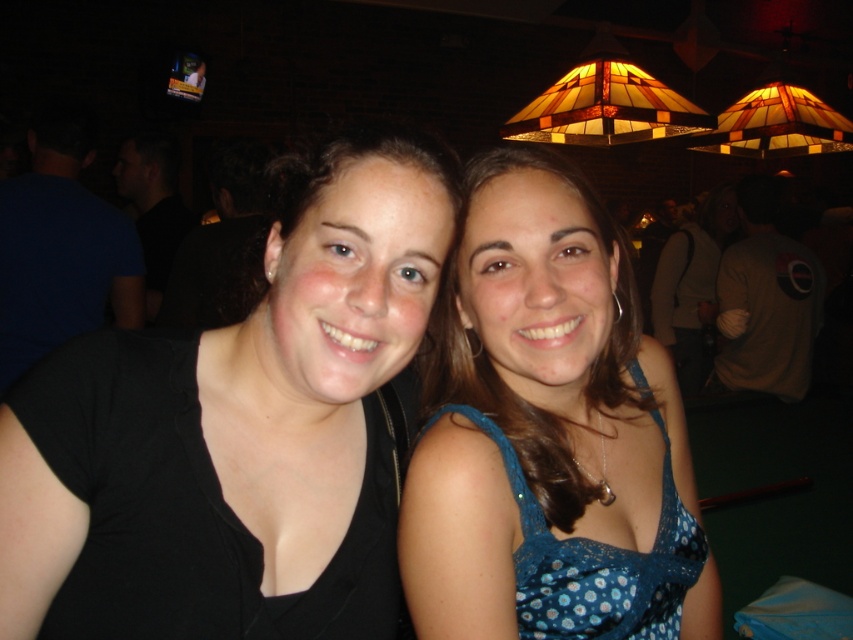
Question: Which point is closer to the camera taking this photo?

Choices:
 (A) (537, 172)
 (B) (33, 384)

Answer: (B)

Question: Does black matte shirt at left lie behind blue dotted dress at center?

Choices:
 (A) no
 (B) yes

Answer: (A)

Question: Is black matte shirt at left closer to camera compared to blue dotted dress at center?

Choices:
 (A) yes
 (B) no

Answer: (A)

Question: Is black matte shirt at left wider than blue dotted dress at center?

Choices:
 (A) yes
 (B) no

Answer: (B)

Question: Which object appears closest to the camera in this image?

Choices:
 (A) black matte shirt at left
 (B) blue dotted dress at center

Answer: (A)